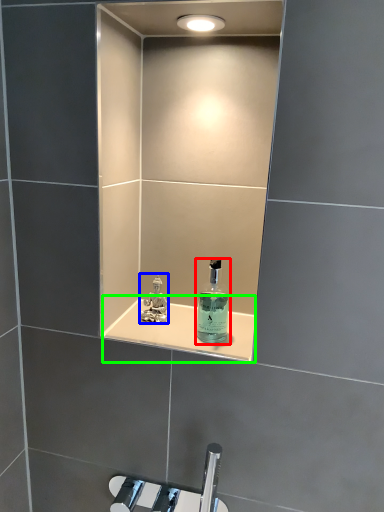
Question: Considering the real-world distances, which object is closest to bottle (highlighted by a red box)? perfume (highlighted by a blue box) or shelve (highlighted by a green box).

Choices:
 (A) perfume
 (B) shelve

Answer: (B)